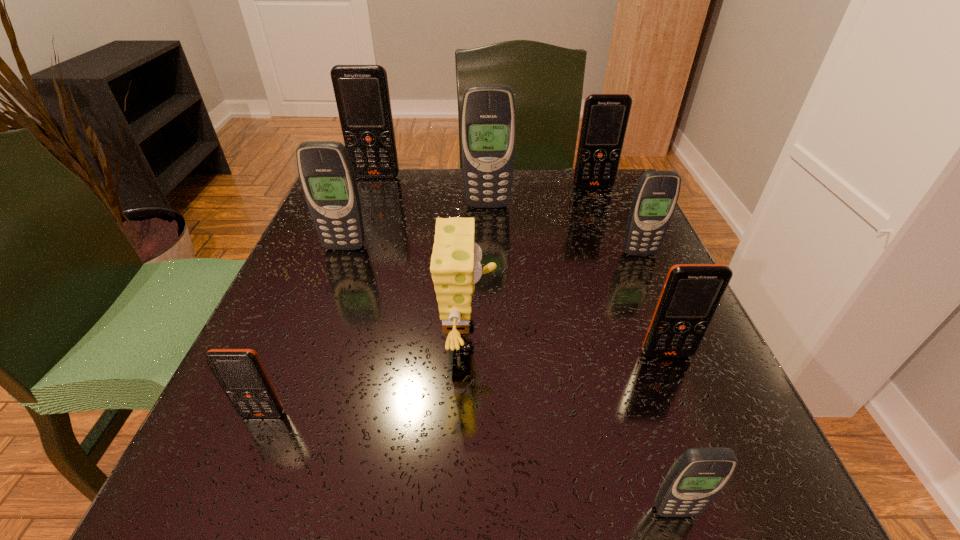
This screenshot has height=540, width=960. I want to click on the farthest object, so click(x=362, y=96).

Locate an element on the screen. the biggest orange cellular telephone is located at coordinates (362, 96).

I want to click on the sixth nearest cellular telephone, so click(488, 115).

Where is `the third farthest object`? This screenshot has width=960, height=540. the third farthest object is located at coordinates (488, 115).

Locate an element on the screen. the seventh nearest cellular telephone is located at coordinates (605, 117).

Identify the location of the second biggest orange cellular telephone. (605, 117).

Image resolution: width=960 pixels, height=540 pixels. Find the location of `the leftmost gray cellular telephone`. the leftmost gray cellular telephone is located at coordinates [x=325, y=169].

This screenshot has width=960, height=540. Identify the location of yellow sponge. (455, 266).

Where is `the rightmost gray cellular telephone`? This screenshot has height=540, width=960. the rightmost gray cellular telephone is located at coordinates (656, 195).

The height and width of the screenshot is (540, 960). Identify the location of the second smallest orange cellular telephone. (691, 294).